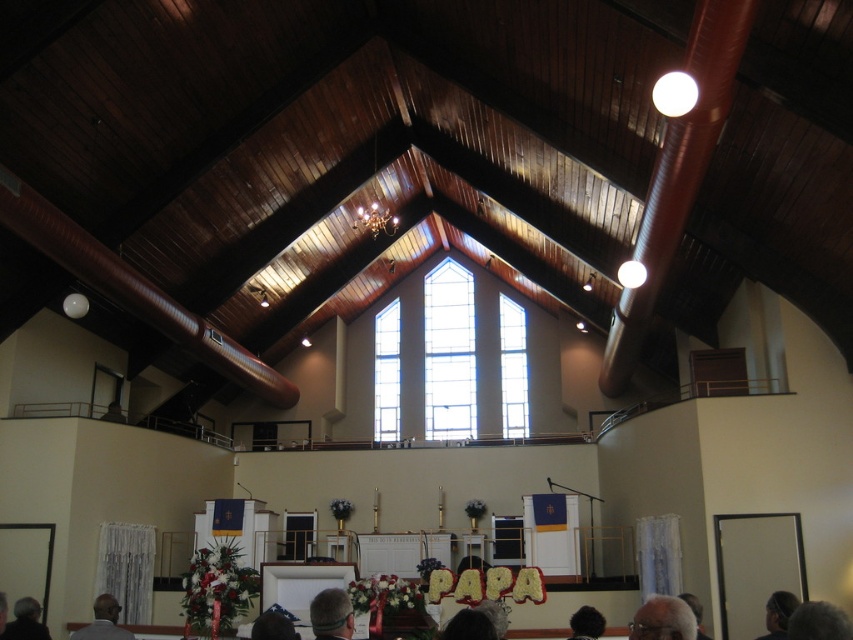
Question: Which is farther from the dark gray hair at lower left?

Choices:
 (A) black fur hat at lower center
 (B) gray hair at lower right
 (C) gray hair at lower left

Answer: (B)

Question: Can you confirm if gray hair at lower right is positioned below gray hair at lower left?

Choices:
 (A) no
 (B) yes

Answer: (A)

Question: Estimate the real-world distances between objects in this image. Which object is farther from the gray hair at lower center?

Choices:
 (A) gray hair at lower left
 (B) gray hair at lower right
 (C) dark gray hair at lower left
 (D) black fur hat at lower center

Answer: (D)

Question: Does gray hair at lower left have a larger size compared to black fur hat at lower center?

Choices:
 (A) yes
 (B) no

Answer: (A)

Question: Does dark gray hair at lower left appear over black fur hat at lower center?

Choices:
 (A) no
 (B) yes

Answer: (B)

Question: Among these points, which one is nearest to the camera?

Choices:
 (A) (630, 625)
 (B) (325, 618)

Answer: (B)